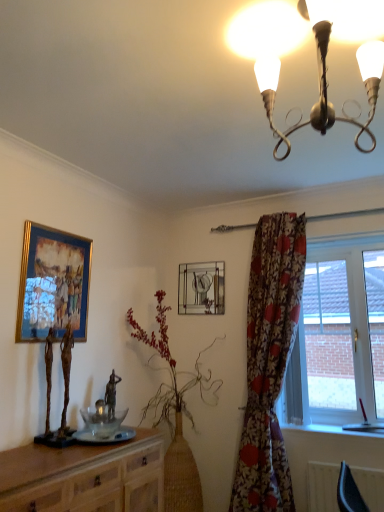
Question: Considering the positions of point (64, 502) and point (283, 338), is point (64, 502) closer or farther from the camera than point (283, 338)?

Choices:
 (A) closer
 (B) farther

Answer: (A)

Question: Looking at the image, does wooden cabinet at lower left seem bigger or smaller compared to floral fabric curtain at right?

Choices:
 (A) small
 (B) big

Answer: (A)

Question: Which of these objects is positioned closest to the white plastic window at right?

Choices:
 (A) metallic chandelier at upper center
 (B) metallic glass clock at center, which is the 1th picture frame from back to front
 (C) wooden cabinet at lower left
 (D) gold-framed painting at upper left, which appears as the first picture frame when viewed from the front
 (E) floral fabric curtain at right

Answer: (E)

Question: Estimate the real-world distances between objects in this image. Which object is farther from the metallic glass clock at center, which is the second picture frame from left to right?

Choices:
 (A) metallic chandelier at upper center
 (B) wooden cabinet at lower left
 (C) green leafy plant at center
 (D) white plastic window at right
 (E) gold-framed painting at upper left, which appears as the first picture frame when viewed from the left

Answer: (A)